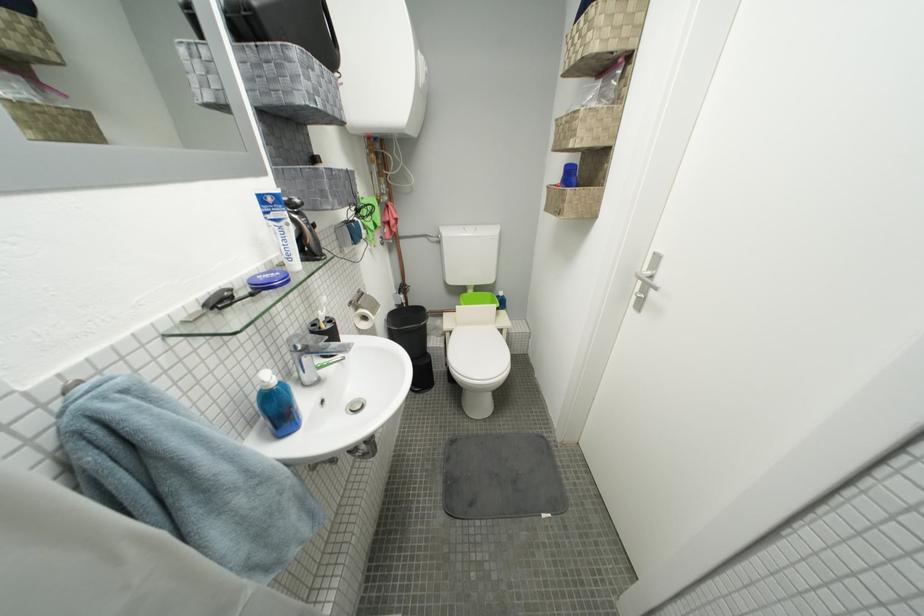
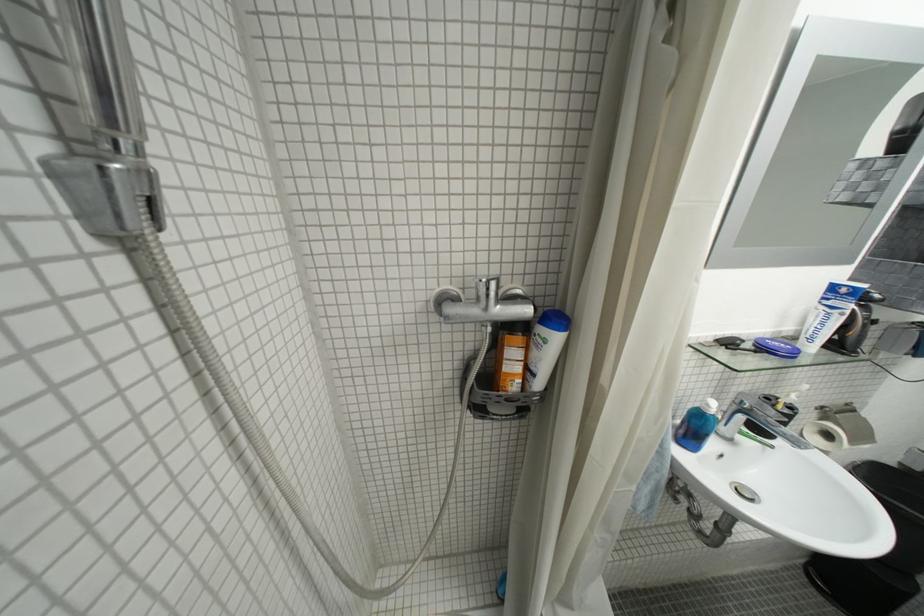
Locate, in the second image, the point that corresponds to pixel 373 321 in the first image.

(836, 438)